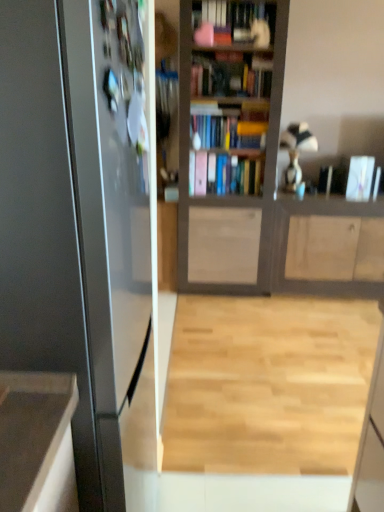
Locate an element on the screen. The width and height of the screenshot is (384, 512). pink matte book at center, which is counted as the 2th book, starting from the right is located at coordinates (225, 173).

What do you see at coordinates (83, 228) in the screenshot? The width and height of the screenshot is (384, 512). I see `metallic refrigerator at left` at bounding box center [83, 228].

Where is `wooden bookcase at center`? wooden bookcase at center is located at coordinates (231, 151).

Looking at this image, does wooden bookcase at center have a greater height compared to light wood floor at center?

Correct, wooden bookcase at center is much taller as light wood floor at center.

Is wooden bookcase at center positioned with its back to light wood floor at center?

That's not correct — wooden bookcase at center is not looking away from light wood floor at center.

Consider the image. Which object is further away from the camera taking this photo, wooden bookcase at center or light wood floor at center?

wooden bookcase at center is further from the camera.

Is wooden bookcase at center directly adjacent to light wood floor at center?

No, wooden bookcase at center is not touching light wood floor at center.

Between wooden bookcase at center and metallic refrigerator at left, which one appears on the left side from the viewer's perspective?

metallic refrigerator at left.

Which object is wider, wooden bookcase at center or metallic refrigerator at left?

Wider between the two is metallic refrigerator at left.

Is wooden bookcase at center inside or outside of metallic refrigerator at left?

wooden bookcase at center is spatially situated outside metallic refrigerator at left.

Is wooden bookcase at center oriented away from metallic refrigerator at left?

No, wooden bookcase at center's orientation is not away from metallic refrigerator at left.

Is wooden bookcase at center bigger than pink matte book at center, which is counted as the first book, starting from the left?

Indeed, wooden bookcase at center has a larger size compared to pink matte book at center, which is counted as the first book, starting from the left.

How different are the orientations of wooden bookcase at center and pink matte book at center, which is counted as the first book, starting from the left, in degrees?

The angular difference between wooden bookcase at center and pink matte book at center, which is counted as the first book, starting from the left, is 0.98 degrees.

Based on the photo, between wooden bookcase at center and pink matte book at center, which is counted as the first book, starting from the left, which one has less height?

Standing shorter between the two is pink matte book at center, which is counted as the first book, starting from the left.

From the image's perspective, starting from the wooden bookcase at center, which book is the 1st one below? Please provide its 2D coordinates.

[(225, 173)]

Is pink matte book at center, which is counted as the 2th book, starting from the right, with light wood floor at center?

No, pink matte book at center, which is counted as the 2th book, starting from the right, is not touching light wood floor at center.

From a real-world perspective, which book is the 2nd one above the light wood floor at center? Please provide its 2D coordinates.

[(225, 173)]

Does pink matte book at center, which is counted as the 2th book, starting from the right, have a lesser height compared to light wood floor at center?

No.

Is point (201, 181) closer to camera compared to point (231, 428)?

No.

Does wooden bookcase at center have a lesser width compared to wooden cabinet at center?

In fact, wooden bookcase at center might be wider than wooden cabinet at center.

Can you confirm if wooden bookcase at center is bigger than wooden cabinet at center?

Result: Correct, wooden bookcase at center is larger in size than wooden cabinet at center.

Would you say wooden bookcase at center is outside wooden cabinet at center?

That's correct, wooden bookcase at center is outside of wooden cabinet at center.

Consider the image. From the image's perspective, who appears lower, wooden bookcase at center or wooden cabinet at center?

From the image's view, wooden cabinet at center is below.

Would you say white glossy book at upper right, which is the 1th book from right to left, is outside pink matte book at center, which is counted as the first book, starting from the left?

Indeed, white glossy book at upper right, which is the 1th book from right to left, is completely outside pink matte book at center, which is counted as the first book, starting from the left.

From a real-world perspective, who is located higher, white glossy book at upper right, which is the 2th book from left to right, or pink matte book at center, which is counted as the 2th book, starting from the right?

pink matte book at center, which is counted as the 2th book, starting from the right, is physically above.

Is white glossy book at upper right, which is the 2th book from left to right, placed right next to pink matte book at center, which is counted as the first book, starting from the left?

white glossy book at upper right, which is the 2th book from left to right, and pink matte book at center, which is counted as the first book, starting from the left, are not in contact.

Can you confirm if white glossy book at upper right, which is the 2th book from left to right, is wider than metallic refrigerator at left?

Incorrect, the width of white glossy book at upper right, which is the 2th book from left to right, does not surpass that of metallic refrigerator at left.

Measure the distance from white glossy book at upper right, which is the 2th book from left to right, to metallic refrigerator at left.

white glossy book at upper right, which is the 2th book from left to right, is 8.35 feet from metallic refrigerator at left.

From the image's perspective, would you say white glossy book at upper right, which is the 1th book from right to left, is shown under metallic refrigerator at left?

No.

Is metallic refrigerator at left at the back of white glossy book at upper right, which is the 2th book from left to right?

No, white glossy book at upper right, which is the 2th book from left to right,'s orientation is not away from metallic refrigerator at left.

What are the coordinates of `plain in front of the wooden bookcase at center` in the screenshot? It's located at (268, 384).

In order to click on appliance on the left of the wooden bookcase at center in this screenshot , I will do `click(83, 228)`.

Considering their positions, is wooden cabinet at center positioned further to wooden bookcase at center than white glossy book at upper right, which is the 1th book from right to left?

white glossy book at upper right, which is the 1th book from right to left, lies further to wooden bookcase at center than the other object.

Considering their positions, is wooden cabinet at center positioned further to white glossy book at upper right, which is the 1th book from right to left, than wooden bookcase at center?

wooden bookcase at center is positioned further to the anchor white glossy book at upper right, which is the 1th book from right to left.

Considering their positions, is light wood floor at center positioned closer to wooden cabinet at center than metallic refrigerator at left?

The object closer to wooden cabinet at center is light wood floor at center.

Which object lies further to the anchor point white glossy book at upper right, which is the 1th book from right to left, pink matte book at center, which is counted as the first book, starting from the left, or wooden bookcase at center?

Among the two, wooden bookcase at center is located further to white glossy book at upper right, which is the 1th book from right to left.

Looking at the image, which one is located further to wooden cabinet at center, wooden bookcase at center or pink matte book at center, which is counted as the 2th book, starting from the right?

pink matte book at center, which is counted as the 2th book, starting from the right, is further to wooden cabinet at center.

Based on the photo, based on their spatial positions, is light wood floor at center or wooden cabinet at center further from metallic refrigerator at left?

Based on the image, wooden cabinet at center appears to be further to metallic refrigerator at left.

Which object lies further to the anchor point wooden bookcase at center, pink matte book at center, which is counted as the 2th book, starting from the right, or white glossy book at upper right, which is the 2th book from left to right?

Among the two, white glossy book at upper right, which is the 2th book from left to right, is located further to wooden bookcase at center.

In the scene shown: When comparing their distances from wooden bookcase at center, does light wood floor at center or white glossy book at upper right, which is the 2th book from left to right, seem further?

light wood floor at center lies further to wooden bookcase at center than the other object.

At what (x,y) coordinates should I click in order to perform the action: click on cabinetry between wooden bookcase at center and white glossy book at upper right, which is the 2th book from left to right, from left to right. Please return your answer as a coordinate pair (x, y). Image resolution: width=384 pixels, height=512 pixels. Looking at the image, I should click on (329, 247).

Find the location of a particular element. The image size is (384, 512). bookcase positioned between metallic refrigerator at left and wooden cabinet at center from near to far is located at coordinates (231, 151).

Locate an element on the screen. This screenshot has width=384, height=512. plain positioned between metallic refrigerator at left and white glossy book at upper right, which is the 1th book from right to left, from near to far is located at coordinates pyautogui.click(x=268, y=384).

What are the coordinates of `bookcase between pink matte book at center, which is counted as the 2th book, starting from the right, and wooden cabinet at center from left to right` in the screenshot? It's located at (231, 151).